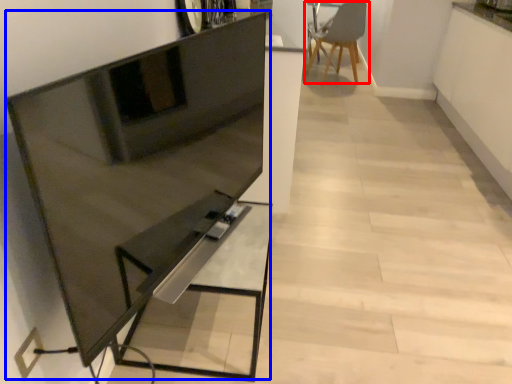
Question: Which object appears farthest to the camera in this image, chair (highlighted by a red box) or entertainment center (highlighted by a blue box)?

Choices:
 (A) chair
 (B) entertainment center

Answer: (A)